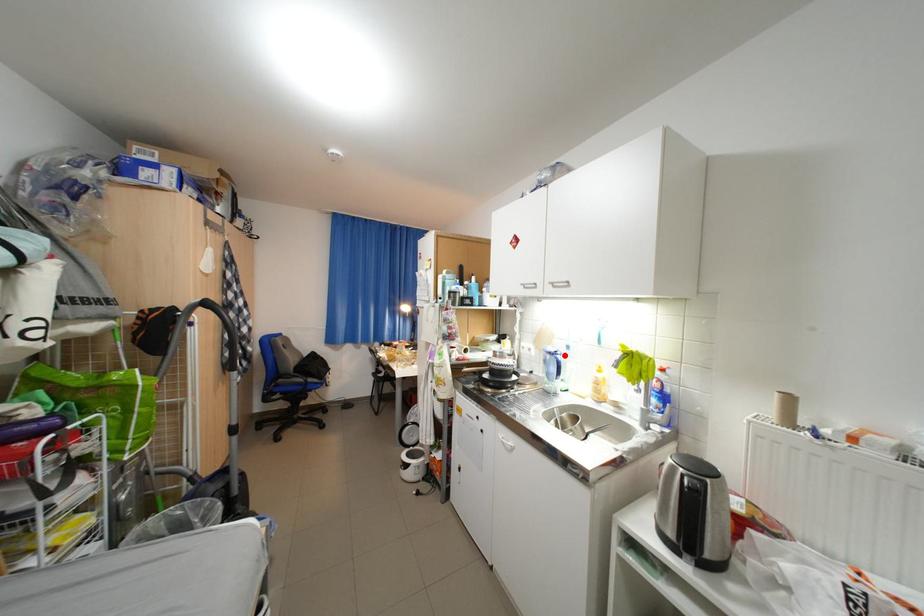
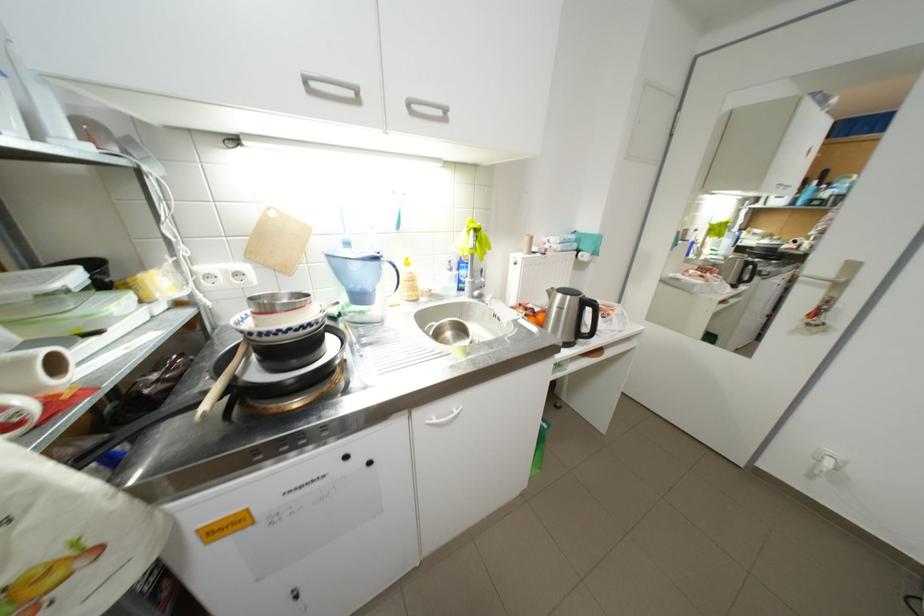
Where in the second image is the point corresponding to the highlighted location from the first image?

(387, 259)